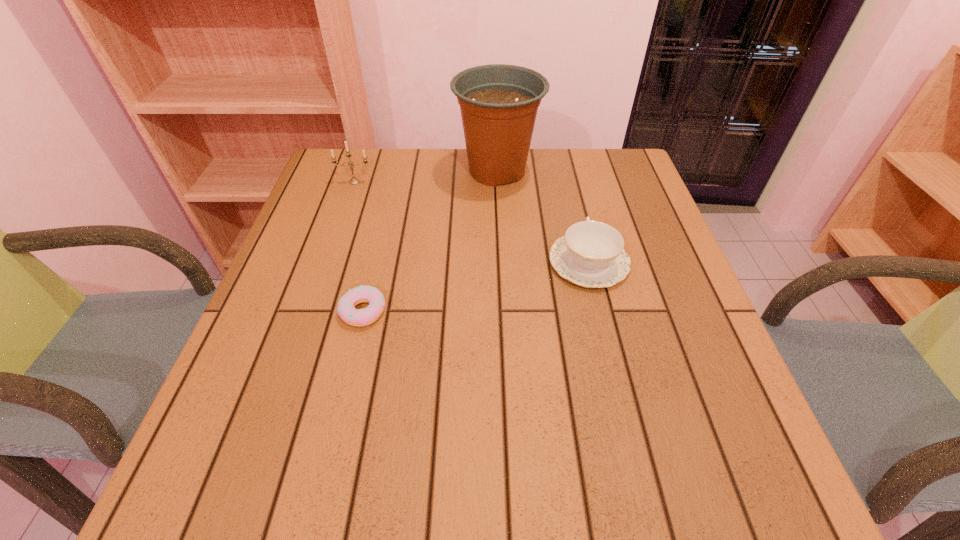
The image size is (960, 540). What are the coordinates of `free space between the tallest object and the third farthest object` in the screenshot? It's located at pyautogui.click(x=543, y=217).

Where is `vacant space in between the shortest object and the flowerpot`? The image size is (960, 540). vacant space in between the shortest object and the flowerpot is located at coordinates (430, 241).

The height and width of the screenshot is (540, 960). I want to click on free space between the flowerpot and the nearest object, so click(x=430, y=241).

I want to click on free space that is in between the chinaware and the flowerpot, so click(543, 217).

Identify the location of empty location between the tallest object and the candle. Image resolution: width=960 pixels, height=540 pixels. (426, 177).

The height and width of the screenshot is (540, 960). I want to click on the closest object to the flowerpot, so click(x=590, y=254).

Locate which object ranks third in proximity to the tallest object. Please provide its 2D coordinates. Your answer should be formatted as a tuple, i.e. [(x, y)], where the tuple contains the x and y coordinates of a point satisfying the conditions above.

[(346, 310)]

Where is `vacant area in the image that satisfies the following two spatial constraints: 1. on the back side of the flowerpot; 2. on the right side of the shortest object`? The width and height of the screenshot is (960, 540). vacant area in the image that satisfies the following two spatial constraints: 1. on the back side of the flowerpot; 2. on the right side of the shortest object is located at coordinates (396, 171).